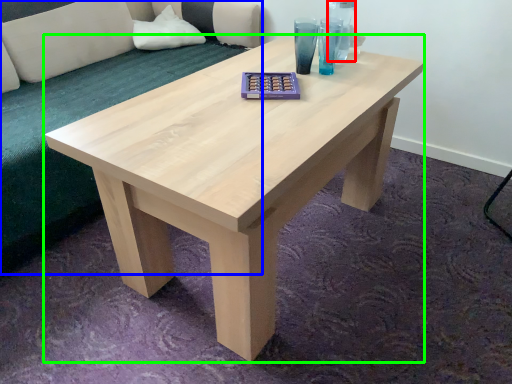
Question: Estimate the real-world distances between objects in this image. Which object is closer to glass vase (highlighted by a red box), couch (highlighted by a blue box) or coffee table (highlighted by a green box)?

Choices:
 (A) couch
 (B) coffee table

Answer: (B)